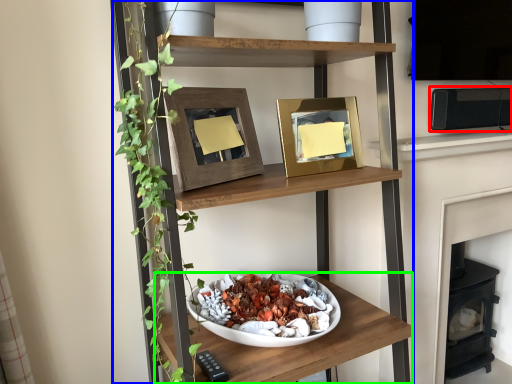
Question: Which is farther away from appliance (highlighted by a red box)? shelf (highlighted by a blue box) or shelf (highlighted by a green box)?

Choices:
 (A) shelf
 (B) shelf

Answer: (B)